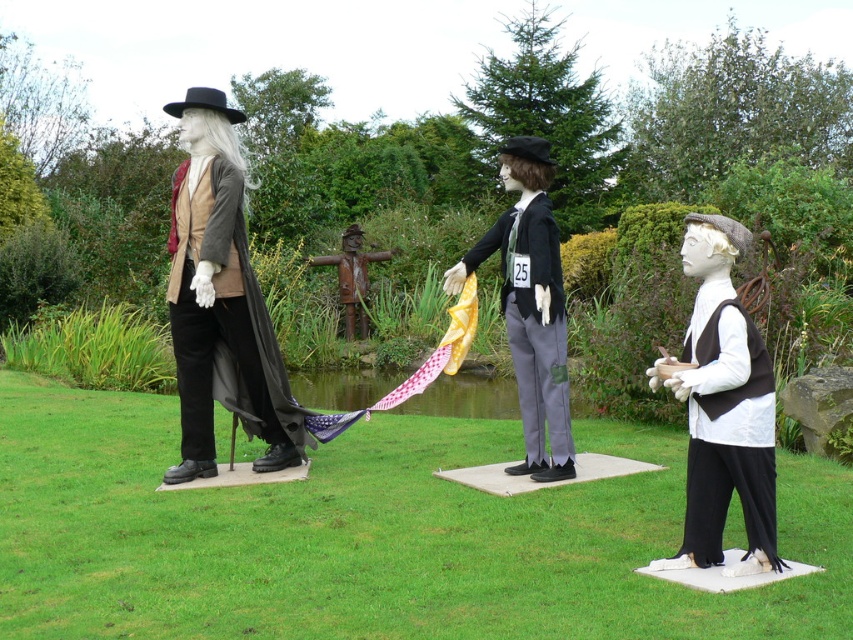
Question: Which point is farther to the camera?

Choices:
 (A) rusty metal scarecrow at center
 (B) matte black vest at right

Answer: (A)

Question: Is matte black coat at left behind matte black suit at center?

Choices:
 (A) yes
 (B) no

Answer: (A)

Question: Does matte black vest at right have a greater width compared to rusty metal scarecrow at center?

Choices:
 (A) no
 (B) yes

Answer: (A)

Question: Based on their relative distances, which object is farther from the matte black coat at left?

Choices:
 (A) rusty metal scarecrow at center
 (B) matte black vest at right
 (C) matte black suit at center

Answer: (A)

Question: Can you confirm if matte black coat at left is wider than matte black vest at right?

Choices:
 (A) yes
 (B) no

Answer: (A)

Question: Which point appears farthest from the camera in this image?

Choices:
 (A) (694, 230)
 (B) (193, 179)
 (C) (527, 321)

Answer: (B)